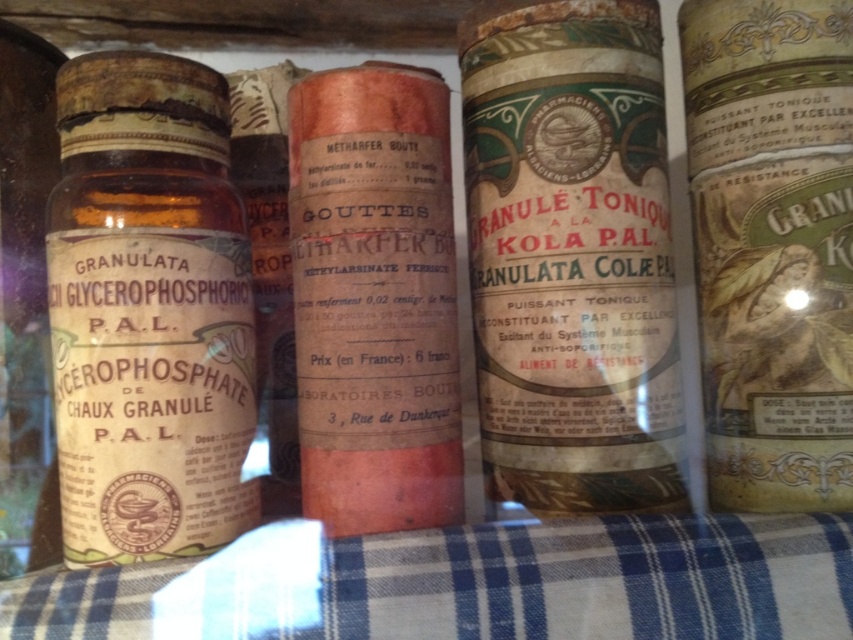
You are a pharmacist examining the vintage bottles. You notice the green paper label at center and the orange paper bottle at center. Which object has a bigger size?

The green paper label at center is larger in size than the orange paper bottle at center.

From the picture: You are standing in front of the vintage medicine bottles displayed on the blue and white checkered cloth. There are two points marked on the image, one at coordinates point (479, 282) and another at point (764, 333). From your perspective, which point is closer to you?

Point (764, 333) is closer to you because the description states that point (479, 282) is behind point (764, 333).